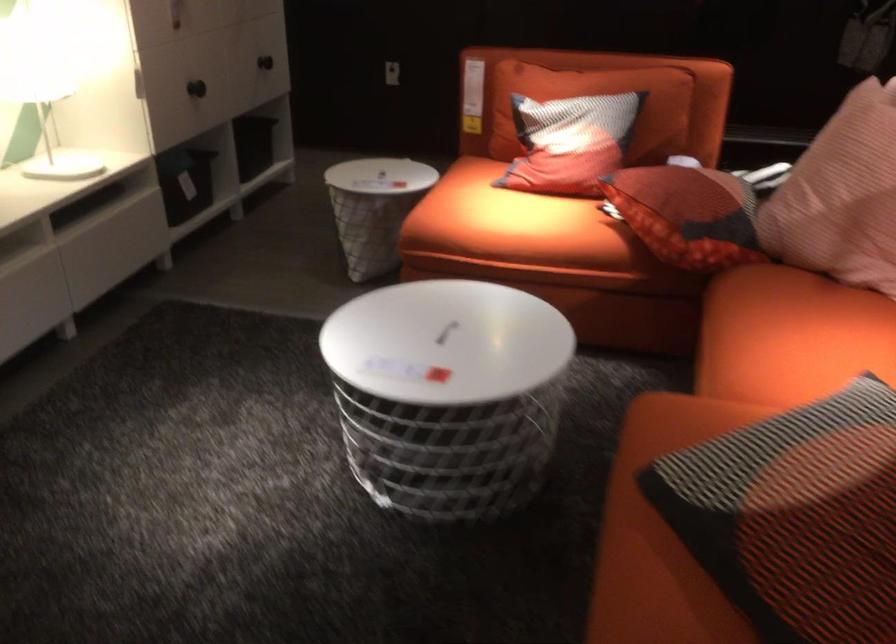
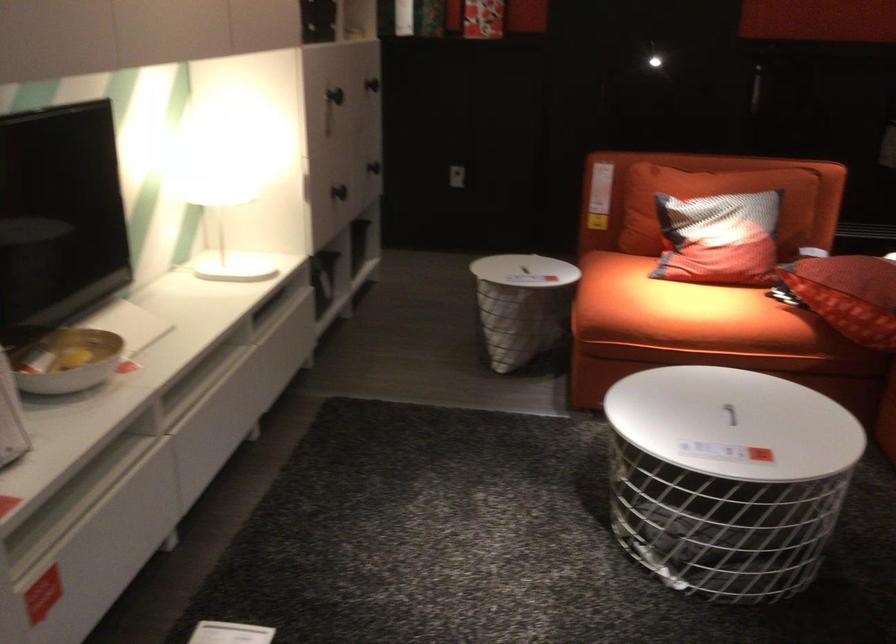
Locate, in the second image, the point that corresponds to point (469, 328) in the first image.

(729, 413)